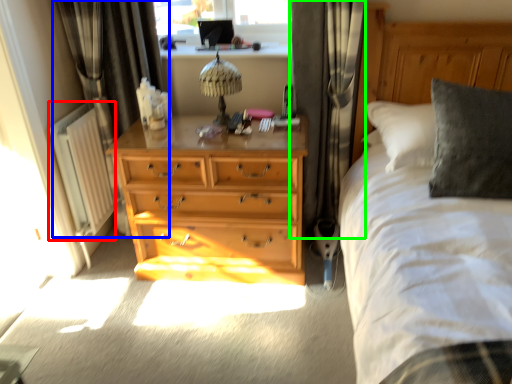
Question: Which is nearer to the radiator (highlighted by a red box)? curtain (highlighted by a blue box) or curtain (highlighted by a green box).

Choices:
 (A) curtain
 (B) curtain

Answer: (A)